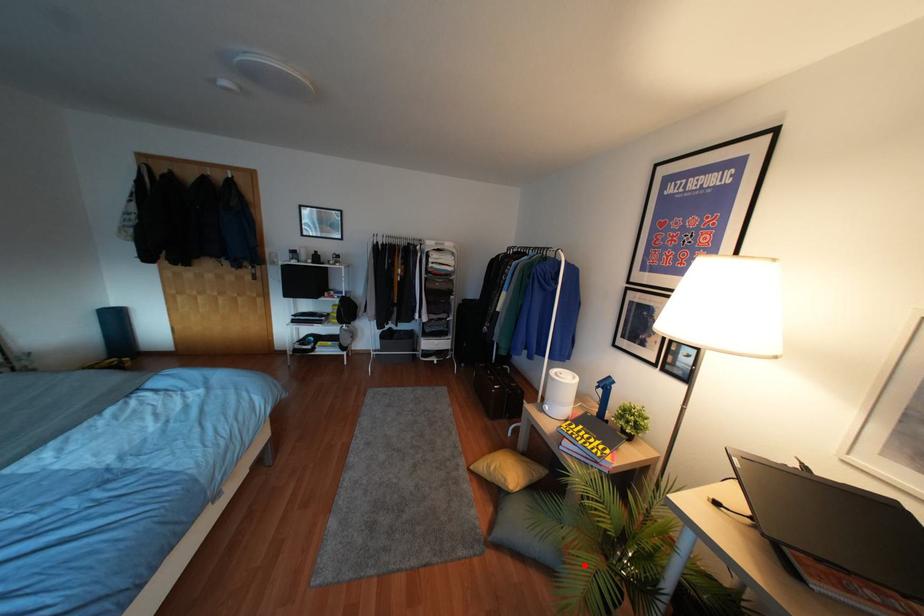
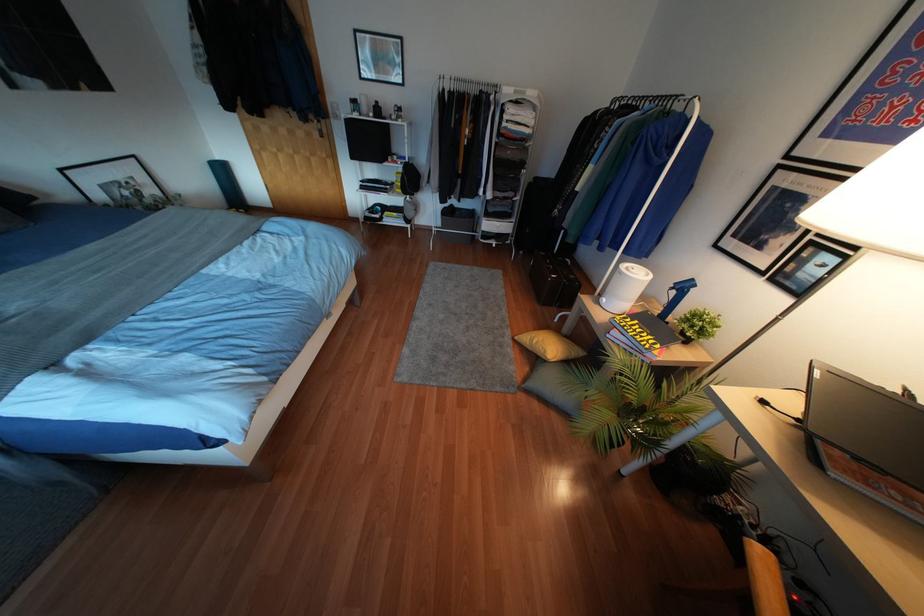
Where in the second image is the point corresponding to the highlighted location from the first image?

(600, 416)